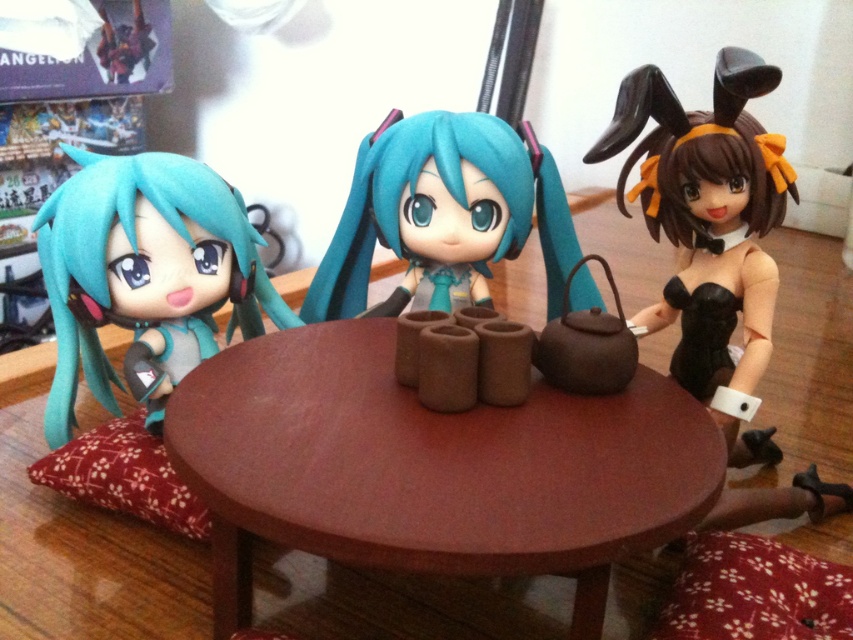
Question: Does matte brown teapot at center appear under red fabric pillow at lower left?

Choices:
 (A) no
 (B) yes

Answer: (A)

Question: Is brown matte table at center to the right of matte teal hair at left from the viewer's perspective?

Choices:
 (A) no
 (B) yes

Answer: (B)

Question: Which of the following is the closest to the observer?

Choices:
 (A) tap(138, 200)
 (B) tap(180, 509)

Answer: (B)

Question: Which point appears closest to the camera in this image?

Choices:
 (A) (175, 360)
 (B) (459, 481)
 (C) (149, 445)
 (D) (729, 141)

Answer: (B)

Question: Is black satin dress at right further to camera compared to matte brown teapot at center?

Choices:
 (A) yes
 (B) no

Answer: (B)

Question: Which point is farther to the camera?

Choices:
 (A) (541, 230)
 (B) (50, 257)
 (C) (135, 412)
 (D) (556, 557)

Answer: (A)